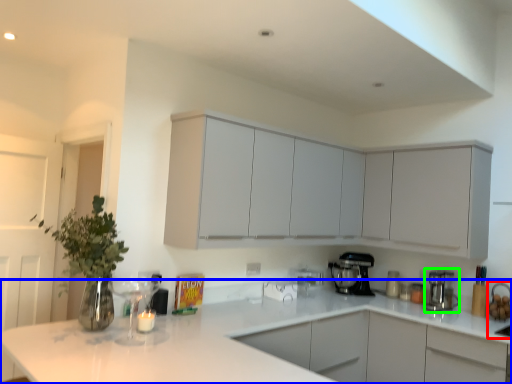
Question: Which object is the farthest from sink (highlighted by a red box)? Choose among these: countertop (highlighted by a blue box) or kitchen appliance (highlighted by a green box).

Choices:
 (A) countertop
 (B) kitchen appliance

Answer: (A)